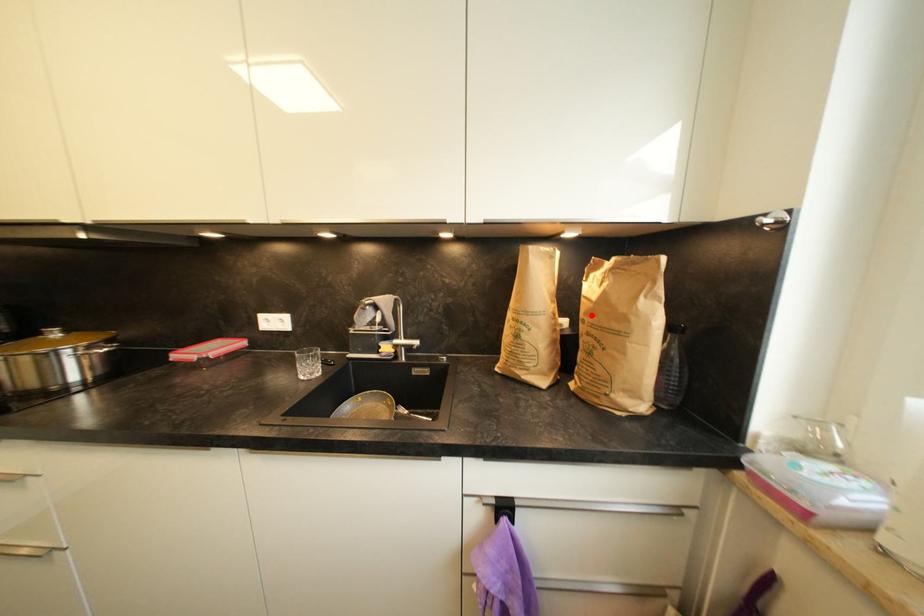
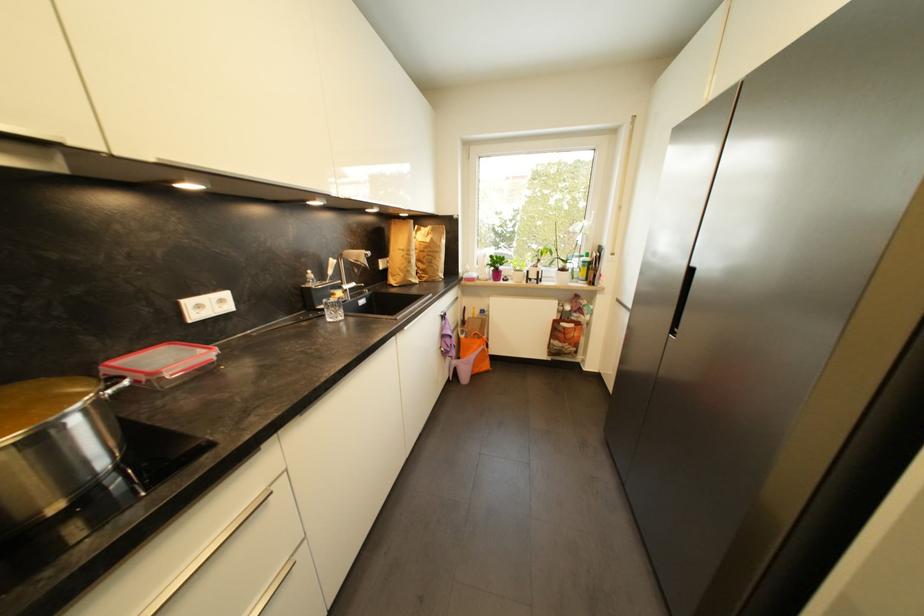
Question: I am providing you with two images of the same scene from different viewpoints. A red point is shown in image1. For the corresponding object point in image2, is it positioned nearer or farther from the camera?

Choices:
 (A) Nearer
 (B) Farther

Answer: (A)